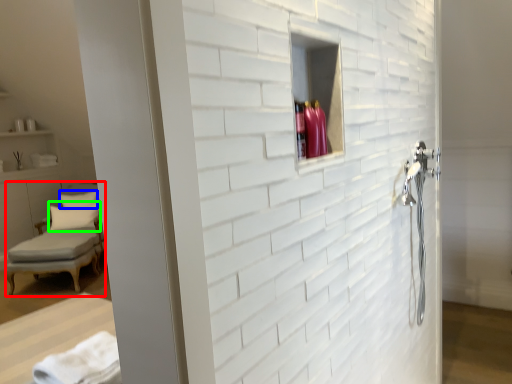
Question: Which object is positioned closest to chair (highlighted by a red box)? Select from pillow (highlighted by a blue box) and pillow (highlighted by a green box).

Choices:
 (A) pillow
 (B) pillow

Answer: (B)